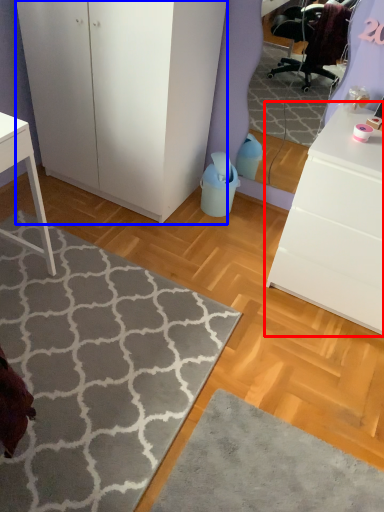
Question: Which object appears farthest to the camera in this image, chest of drawers (highlighted by a red box) or cabinetry (highlighted by a blue box)?

Choices:
 (A) chest of drawers
 (B) cabinetry

Answer: (B)